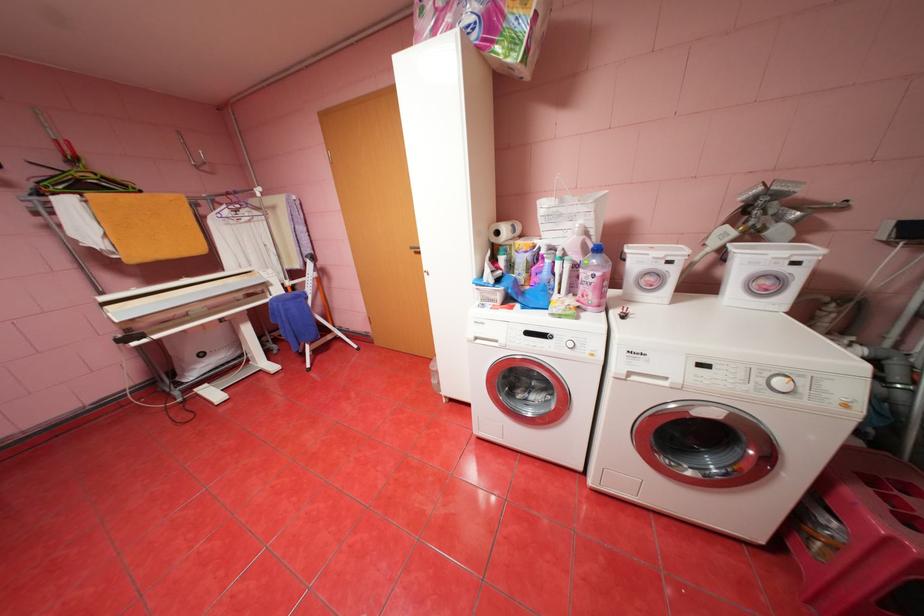
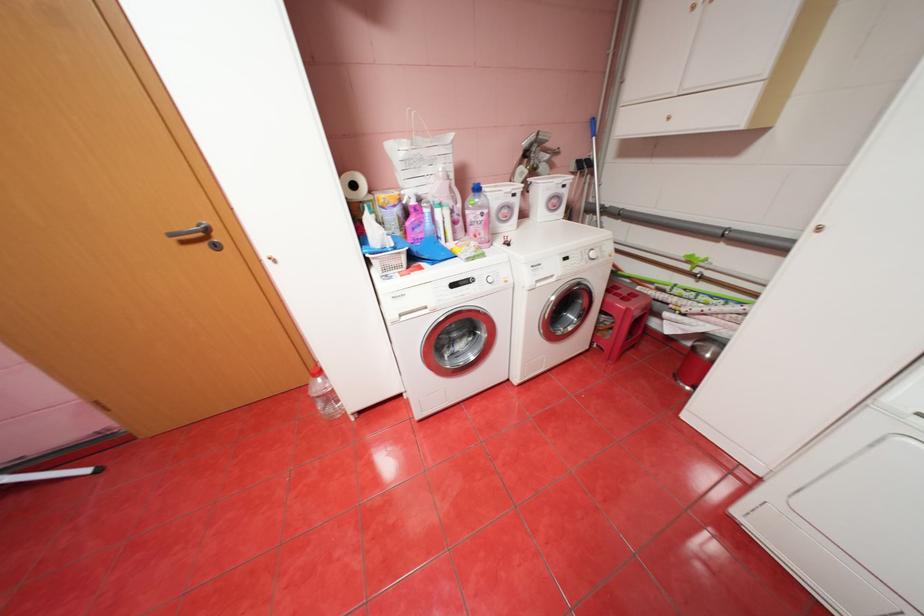
Locate, in the second image, the point that corresponds to pixel 771 381 in the first image.

(596, 256)